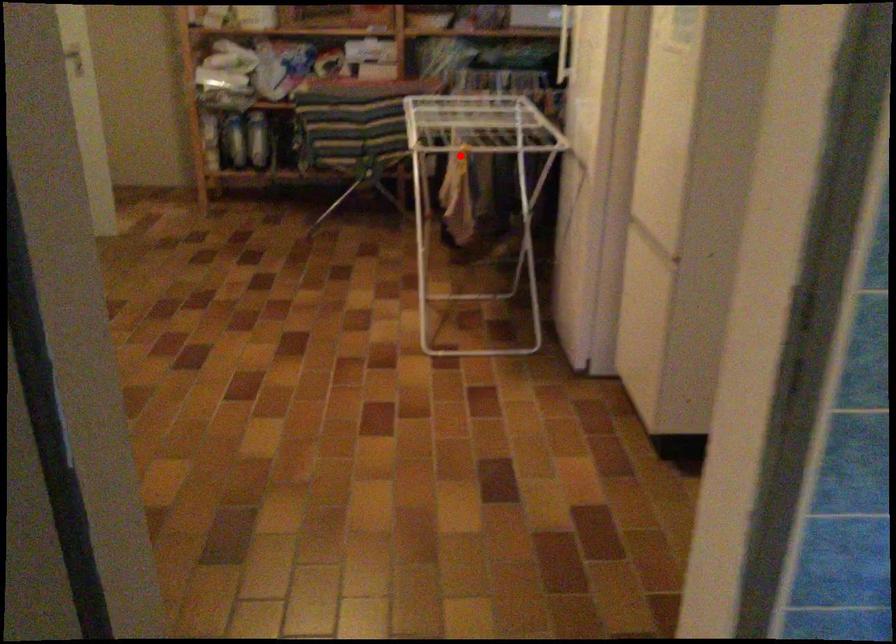
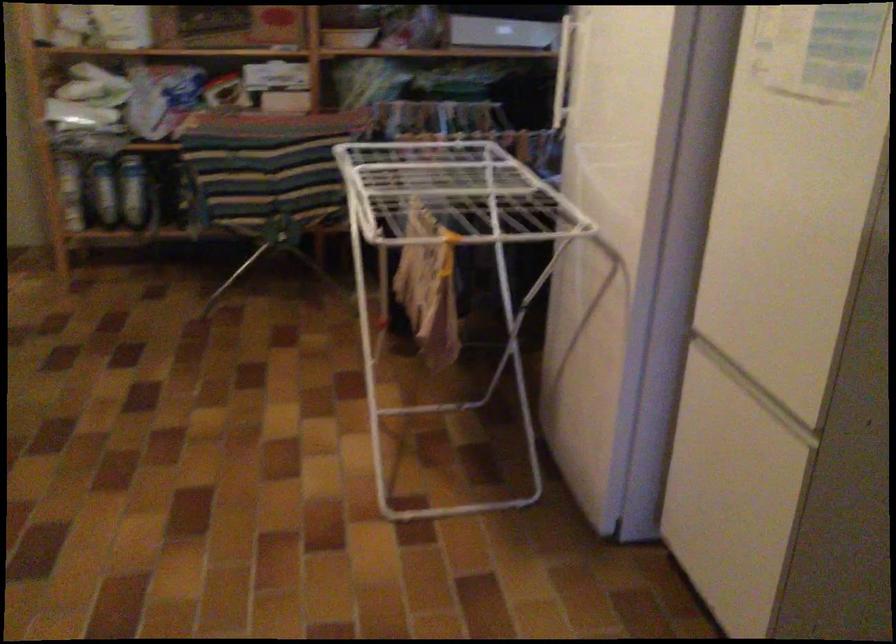
Locate, in the second image, the point that corresponds to the highlighted location in the first image.

(450, 258)